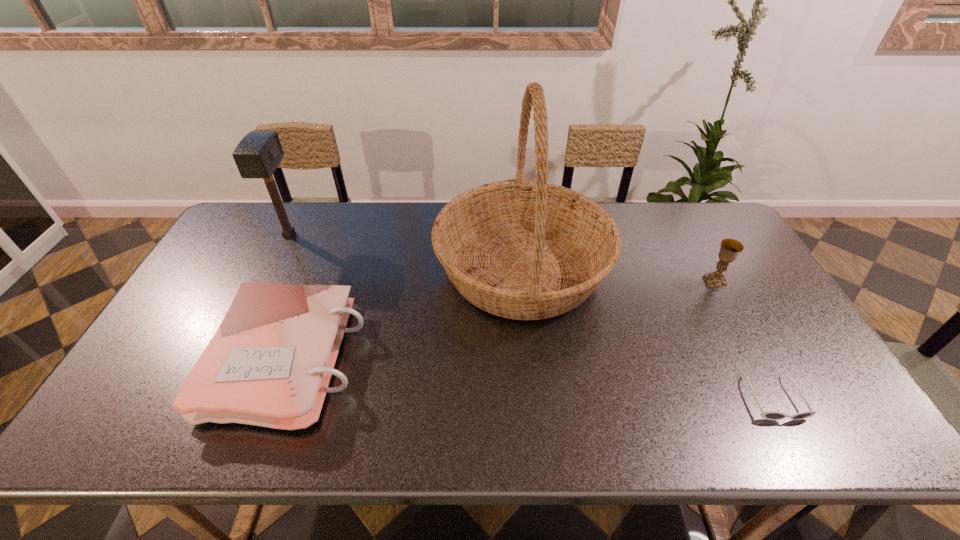
Locate an element on the screen. This screenshot has height=540, width=960. the tallest object is located at coordinates (520, 249).

You are a GUI agent. You are given a task and a screenshot of the screen. Output one action in this format:
    pyautogui.click(x=<x>, y=<y>)
    Task: Click on the basket
    The width and height of the screenshot is (960, 540).
    Given the screenshot: What is the action you would take?
    pyautogui.click(x=520, y=249)

Image resolution: width=960 pixels, height=540 pixels. Identify the location of the second tallest object. (258, 154).

At what (x,y) coordinates should I click in order to perform the action: click on chalice. Please return your answer as a coordinate pair (x, y). The height and width of the screenshot is (540, 960). Looking at the image, I should click on (730, 248).

This screenshot has width=960, height=540. What are the coordinates of `the fourth tallest object` in the screenshot? It's located at (269, 364).

Where is `the shortest object`? the shortest object is located at coordinates (769, 415).

Identify the location of vacant space located on the left of the third object from right to left. The image size is (960, 540). (410, 269).

Where is `vacant area situated 0.060m on the front of the mallet`? vacant area situated 0.060m on the front of the mallet is located at coordinates (276, 260).

At what (x,y) coordinates should I click in order to perform the action: click on free region located 0.290m on the front of the chalice. Please return your answer as a coordinate pair (x, y). Looking at the image, I should click on (765, 373).

The width and height of the screenshot is (960, 540). Find the location of `vacant space located 0.250m on the back of the phonebook`. vacant space located 0.250m on the back of the phonebook is located at coordinates click(x=332, y=245).